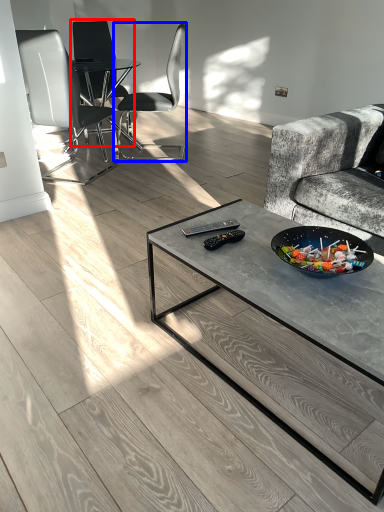
Question: Which object appears closest to the camera in this image, chair (highlighted by a red box) or chair (highlighted by a blue box)?

Choices:
 (A) chair
 (B) chair

Answer: (B)